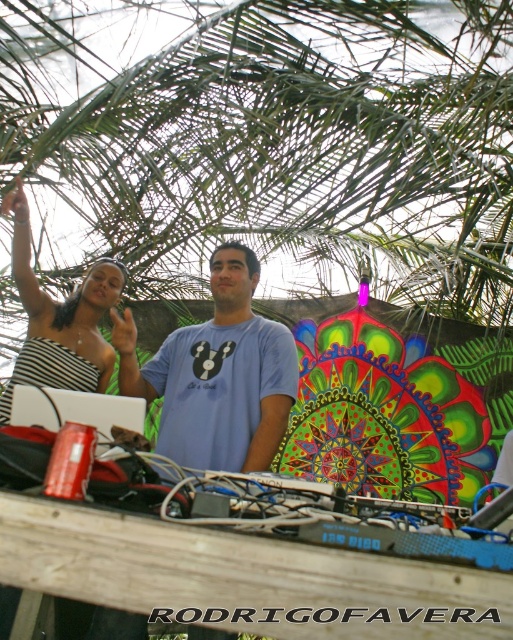
Question: Is blue cotton t-shirt at center smaller than striped fabric dress at upper left?

Choices:
 (A) yes
 (B) no

Answer: (B)

Question: Is blue cotton t-shirt at center below striped fabric dress at upper left?

Choices:
 (A) yes
 (B) no

Answer: (A)

Question: Can you confirm if blue cotton t-shirt at center is thinner than striped fabric dress at upper left?

Choices:
 (A) yes
 (B) no

Answer: (B)

Question: Among these points, which one is nearest to the camera?

Choices:
 (A) (218, 436)
 (B) (10, 202)

Answer: (A)

Question: Which object is farther from the camera taking this photo?

Choices:
 (A) blue cotton t-shirt at center
 (B) striped fabric dress at upper left

Answer: (B)